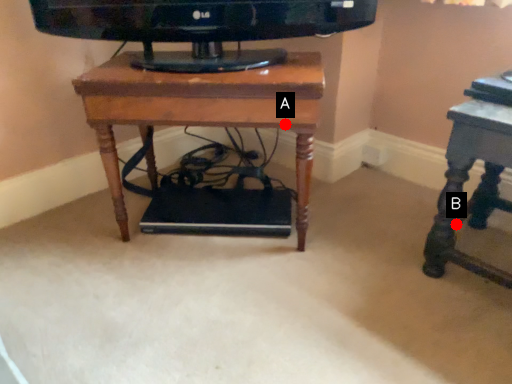
Question: Two points are circled on the image, labeled by A and B beside each circle. Which point is farther from the camera taking this photo?

Choices:
 (A) A is further
 (B) B is further

Answer: (B)